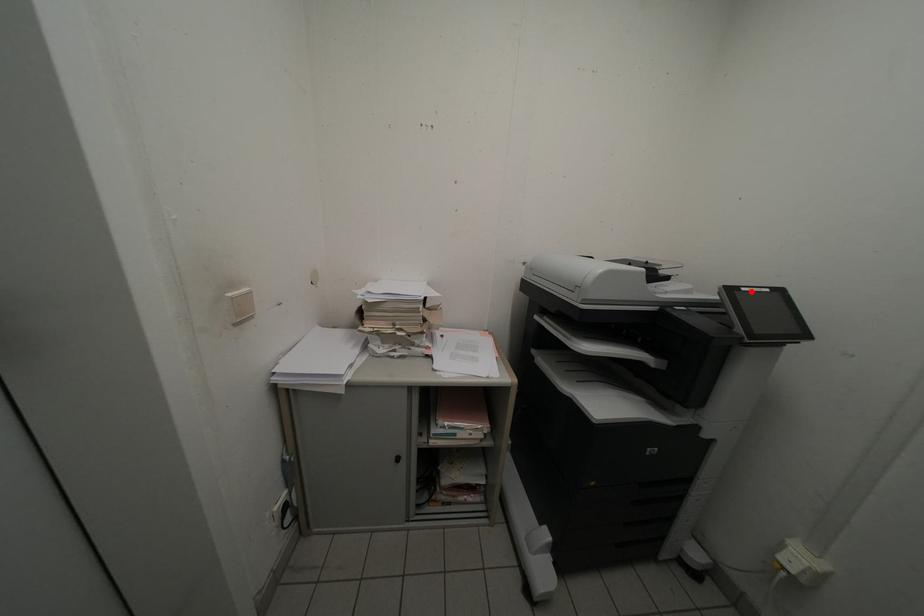
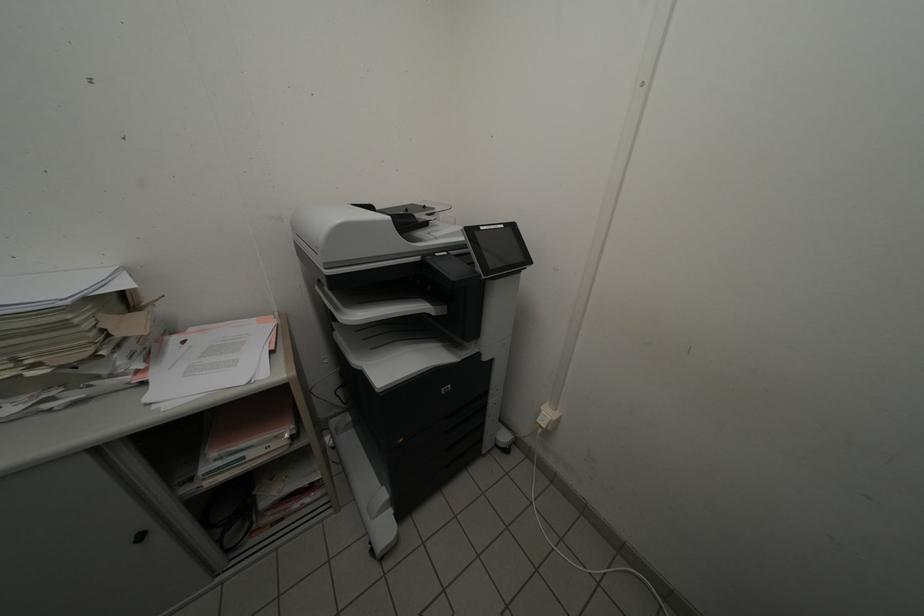
Locate, in the second image, the point that corresponds to the highlighted location in the first image.

(490, 230)